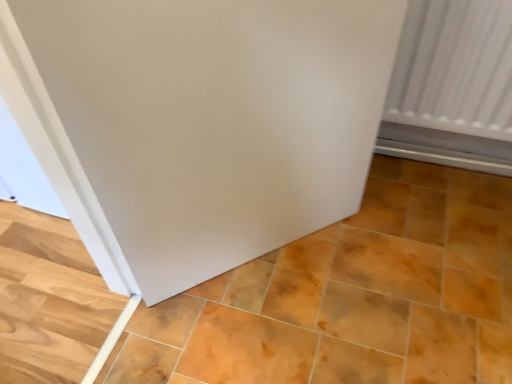
Question: Looking at their shapes, would you say matte orange tile at center is wider or thinner than white matte door at center?

Choices:
 (A) wide
 (B) thin

Answer: (A)

Question: From a real-world perspective, is matte orange tile at center positioned above or below white matte door at center?

Choices:
 (A) below
 (B) above

Answer: (A)

Question: From the image's perspective, is matte orange tile at center positioned above or below white matte door at center?

Choices:
 (A) below
 (B) above

Answer: (A)

Question: Considering the positions of point pos(83,233) and point pos(216,380), is point pos(83,233) closer or farther from the camera than point pos(216,380)?

Choices:
 (A) farther
 (B) closer

Answer: (B)

Question: From the image's perspective, is white matte door at center above or below matte orange tile at center?

Choices:
 (A) below
 (B) above

Answer: (B)

Question: Considering the positions of white matte door at center and matte orange tile at center in the image, is white matte door at center wider or thinner than matte orange tile at center?

Choices:
 (A) thin
 (B) wide

Answer: (A)

Question: From a real-world perspective, is white matte door at center above or below matte orange tile at center?

Choices:
 (A) below
 (B) above

Answer: (B)